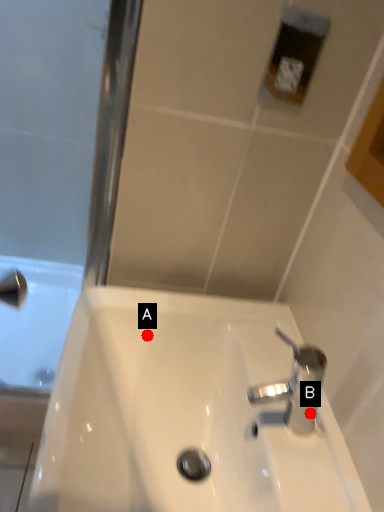
Question: Two points are circled on the image, labeled by A and B beside each circle. Which of the following is the farthest from the observer?

Choices:
 (A) A is further
 (B) B is further

Answer: (A)